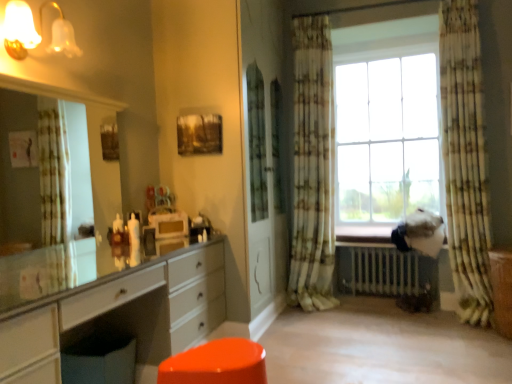
Question: From the image's perspective, would you say patterned fabric curtain at center, acting as the 2th curtain starting from the right, is positioned over brown wood file cabinet at lower right?

Choices:
 (A) no
 (B) yes

Answer: (B)

Question: Is patterned fabric curtain at center, acting as the 2th curtain starting from the right, next to brown wood file cabinet at lower right?

Choices:
 (A) no
 (B) yes

Answer: (A)

Question: From the image's perspective, is patterned fabric curtain at center, which appears as the first curtain when viewed from the left, beneath brown wood file cabinet at lower right?

Choices:
 (A) yes
 (B) no

Answer: (B)

Question: Is patterned fabric curtain at center, acting as the 2th curtain starting from the right, bigger than brown wood file cabinet at lower right?

Choices:
 (A) yes
 (B) no

Answer: (A)

Question: Is the position of patterned fabric curtain at center, acting as the 2th curtain starting from the right, more distant than that of brown wood file cabinet at lower right?

Choices:
 (A) no
 (B) yes

Answer: (B)

Question: Is metallic silver radiator at lower center bigger or smaller than matte glass sconce at upper left?

Choices:
 (A) small
 (B) big

Answer: (B)

Question: From the image's perspective, is metallic silver radiator at lower center positioned above or below matte glass sconce at upper left?

Choices:
 (A) below
 (B) above

Answer: (A)

Question: Considering their positions, is metallic silver radiator at lower center located in front of or behind matte glass sconce at upper left?

Choices:
 (A) front
 (B) behind

Answer: (B)

Question: Would you say metallic silver radiator at lower center is to the left or to the right of matte glass sconce at upper left in the picture?

Choices:
 (A) left
 (B) right

Answer: (B)

Question: Looking at their shapes, would you say white glossy chest of drawers at left is wider or thinner than floral fabric curtain at right, the first curtain viewed from the right?

Choices:
 (A) thin
 (B) wide

Answer: (B)

Question: From the image's perspective, relative to floral fabric curtain at right, the first curtain viewed from the right, is white glossy chest of drawers at left above or below?

Choices:
 (A) above
 (B) below

Answer: (B)

Question: In the image, is white glossy chest of drawers at left positioned in front of or behind floral fabric curtain at right, the first curtain viewed from the right?

Choices:
 (A) front
 (B) behind

Answer: (A)

Question: Do you think white glossy chest of drawers at left is within floral fabric curtain at right, the 2th curtain from the left, or outside of it?

Choices:
 (A) inside
 (B) outside

Answer: (B)

Question: Is floral fabric curtain at right, the first curtain viewed from the right, in front of or behind wooden textured picture frame at upper center in the image?

Choices:
 (A) behind
 (B) front

Answer: (A)

Question: Is floral fabric curtain at right, the first curtain viewed from the right, to the left or to the right of wooden textured picture frame at upper center in the image?

Choices:
 (A) right
 (B) left

Answer: (A)